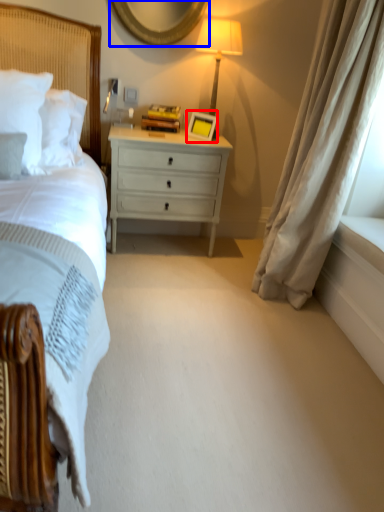
Question: Which object is further to the camera taking this photo, picture frame (highlighted by a red box) or mirror (highlighted by a blue box)?

Choices:
 (A) picture frame
 (B) mirror

Answer: (A)